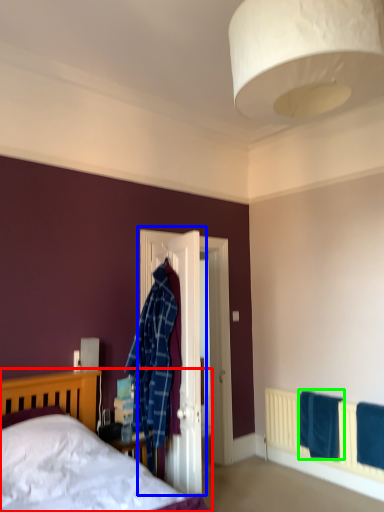
Question: Estimate the real-world distances between objects in this image. Which object is farther from bed (highlighted by a red box), door (highlighted by a blue box) or bath towel (highlighted by a green box)?

Choices:
 (A) door
 (B) bath towel

Answer: (B)